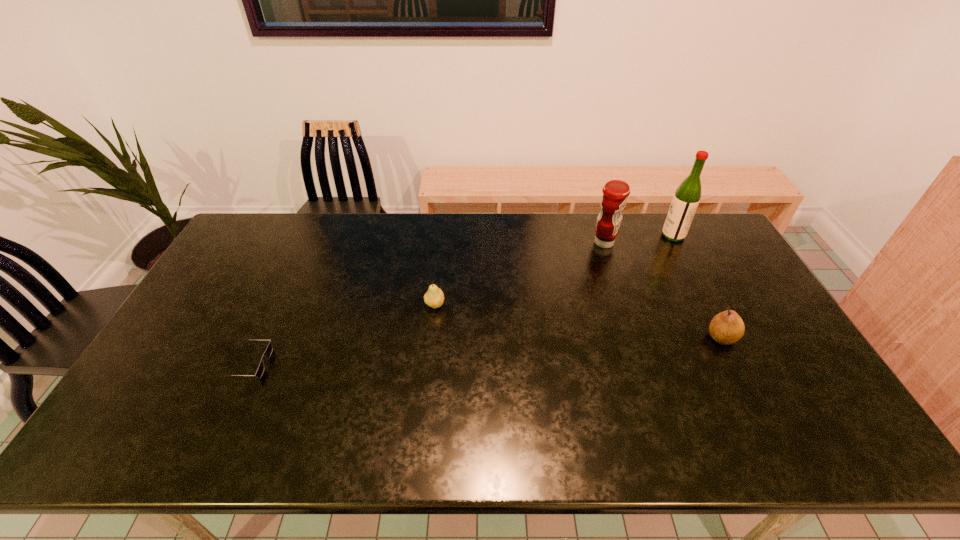
Locate an element on the screen. The width and height of the screenshot is (960, 540). free space between the third object from left to right and the left pear is located at coordinates (519, 274).

In order to click on free space between the third tallest object and the fourth shortest object in this screenshot , I will do `click(663, 290)`.

Identify the location of free space between the tallest object and the right pear. The width and height of the screenshot is (960, 540). (698, 287).

Locate an element on the screen. free area in between the farther pear and the tallest object is located at coordinates (554, 271).

You are a GUI agent. You are given a task and a screenshot of the screen. Output one action in this format:
    pyautogui.click(x=<x>, y=<y>)
    Task: Click on the free space between the sunglasses and the third shortest object
    The image size is (960, 540).
    Given the screenshot: What is the action you would take?
    pyautogui.click(x=485, y=350)

At what (x,y) coordinates should I click in order to perform the action: click on empty location between the fourth object from right to left and the second tallest object. Please return your answer as a coordinate pair (x, y). This screenshot has width=960, height=540. Looking at the image, I should click on (519, 274).

Identify the location of vacant area that lies between the third tallest object and the left pear. (578, 321).

Identify the location of object that can be found as the third closest to the third object from left to right. (434, 297).

Select which object appears as the second closest to the nearer pear. Please provide its 2D coordinates. Your answer should be formatted as a tuple, i.e. [(x, y)], where the tuple contains the x and y coordinates of a point satisfying the conditions above.

[(685, 201)]

Where is `vacant area in the image that satisfies the following two spatial constraints: 1. on the label of the liquor; 2. on the front side of the condiment`? The width and height of the screenshot is (960, 540). vacant area in the image that satisfies the following two spatial constraints: 1. on the label of the liquor; 2. on the front side of the condiment is located at coordinates (677, 243).